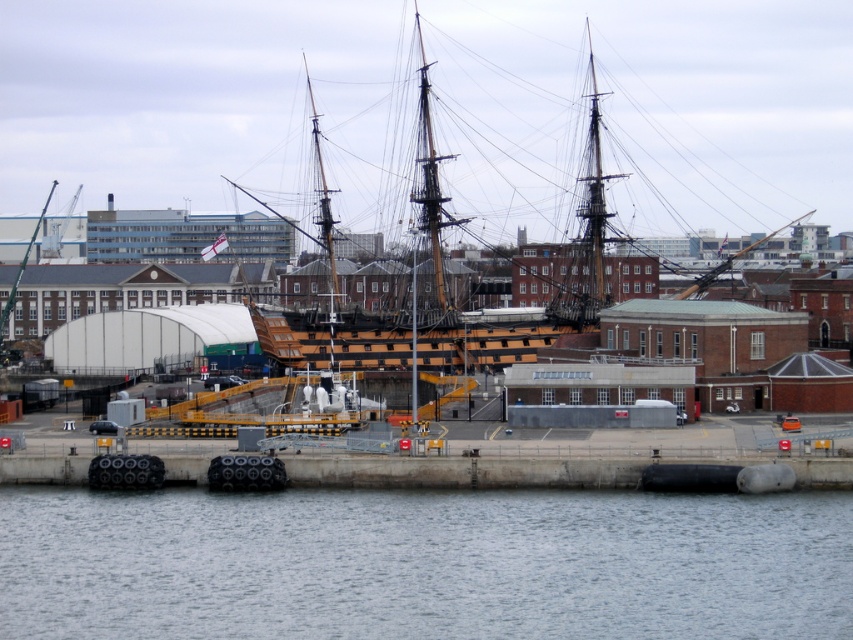
Between wooden ship at center and green matte mast at upper center, which one is positioned lower?

green matte mast at upper center

Consider the image. Is wooden ship at center smaller than green matte mast at upper center?

Incorrect, wooden ship at center is not smaller in size than green matte mast at upper center.

What do you see at coordinates (532, 112) in the screenshot?
I see `wooden ship at center` at bounding box center [532, 112].

Where is `wooden ship at center`? The width and height of the screenshot is (853, 640). wooden ship at center is located at coordinates (532, 112).

Between wooden ship at center and clear water at lower center, which one appears on the left side from the viewer's perspective?

wooden ship at center

Does point (689, 19) lie behind point (704, 548)?

Yes, it is behind point (704, 548).

Describe the element at coordinates (532, 112) in the screenshot. I see `wooden ship at center` at that location.

Locate an element on the screen. wooden ship at center is located at coordinates (532, 112).

Does clear water at lower center come in front of green matte mast at upper center?

Yes, clear water at lower center is closer to the viewer.

Is clear water at lower center taller than green matte mast at upper center?

No, clear water at lower center is not taller than green matte mast at upper center.

Which is in front, point (482, 490) or point (3, 332)?

Point (482, 490) is in front.

The width and height of the screenshot is (853, 640). I want to click on clear water at lower center, so click(422, 563).